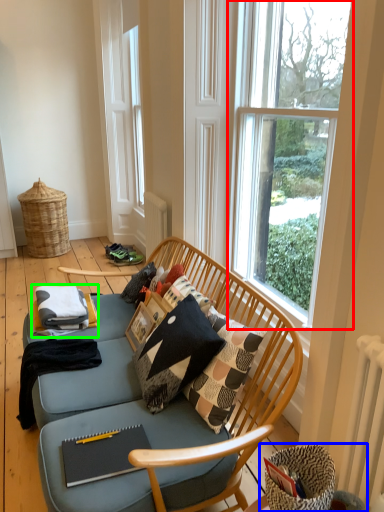
Question: Considering the real-world distances, which object is closest to window (highlighted by a red box)? swivel chair (highlighted by a blue box) or material (highlighted by a green box).

Choices:
 (A) swivel chair
 (B) material

Answer: (A)